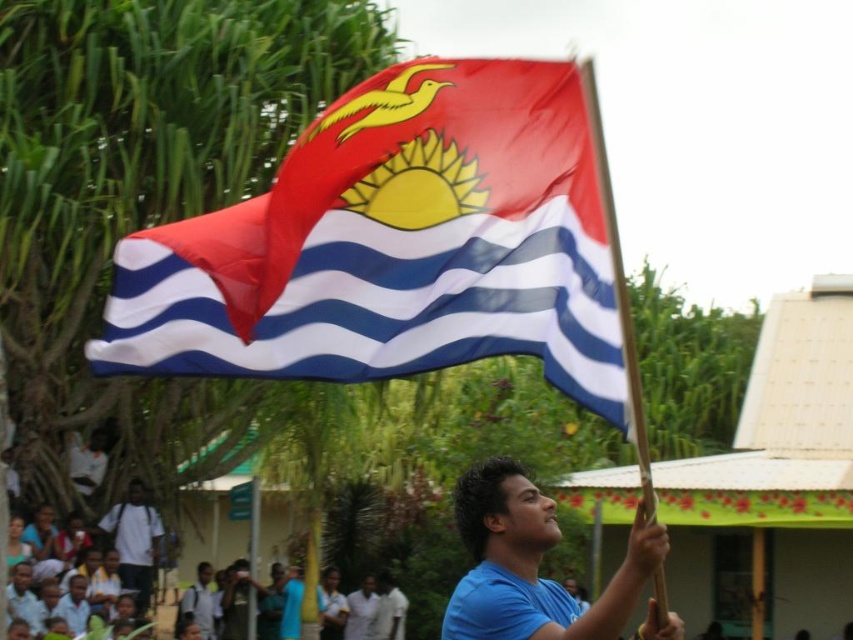
You are a photographer trying to capture the silky fabric flag at center and the blue matte shirt at center in a single shot. Based on their positions, which object should you adjust your camera to focus on first to ensure both are in frame?

The silky fabric flag at center is positioned on the left side of blue matte shirt at center. To ensure both are in frame, focus on the blue matte shirt at center first since it is on the right and adjust the camera to include the flag on the left.

You are a photographer trying to capture the flag in the center of the image. The flag is located at point (396, 244). Can you confirm if this point is indeed where the silky fabric flag at center is positioned?

Yes, the point (396, 244) corresponds to the silky fabric flag at center, so it is correctly positioned there.

Based on the photo, you are a photographer trying to capture the silky fabric flag at center and the white cotton shirt at lower left in the same frame. Based on their positions, which object should you adjust your camera angle to focus on first to ensure both are in the shot?

The silky fabric flag at center is to the right of the white cotton shirt at lower left, so you should adjust your camera angle to focus on the white cotton shirt at lower left first to ensure both objects are captured in the frame.